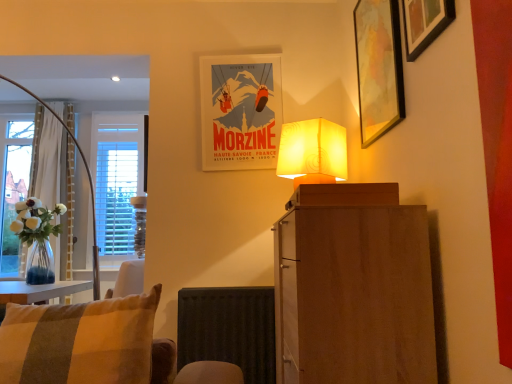
Question: Which direction should I rotate to look at matte paper poster at upper center, the third picture frame viewed from the right?

Choices:
 (A) left
 (B) right

Answer: (A)

Question: Should I look upward or downward to see black matte radiator at lower center?

Choices:
 (A) up
 (B) down

Answer: (B)

Question: Considering the relative sizes of striped fabric cushion at lower left and wooden picture frame at upper right, the second picture frame in the right-to-left sequence, in the image provided, is striped fabric cushion at lower left taller than wooden picture frame at upper right, the second picture frame in the right-to-left sequence,?

Choices:
 (A) yes
 (B) no

Answer: (B)

Question: Is striped fabric cushion at lower left positioned behind wooden picture frame at upper right, which is counted as the second picture frame, starting from the left?

Choices:
 (A) yes
 (B) no

Answer: (B)

Question: Can you confirm if striped fabric cushion at lower left is bigger than wooden picture frame at upper right, the second picture frame in the right-to-left sequence?

Choices:
 (A) no
 (B) yes

Answer: (B)

Question: Does striped fabric cushion at lower left appear on the right side of wooden picture frame at upper right, the second picture frame in the right-to-left sequence?

Choices:
 (A) no
 (B) yes

Answer: (A)

Question: From a real-world perspective, is striped fabric cushion at lower left on top of wooden picture frame at upper right, which is counted as the 2th picture frame, starting from the back?

Choices:
 (A) yes
 (B) no

Answer: (B)

Question: Does striped fabric cushion at lower left have a lesser height compared to wooden picture frame at upper right, which is counted as the 2th picture frame, starting from the back?

Choices:
 (A) no
 (B) yes

Answer: (B)

Question: From a real-world perspective, is black matte radiator at lower center beneath matte paper poster at upper center, which is the first picture frame from back to front?

Choices:
 (A) no
 (B) yes

Answer: (B)

Question: Considering the relative positions of black matte radiator at lower center and matte paper poster at upper center, which is the first picture frame from back to front, in the image provided, is black matte radiator at lower center behind matte paper poster at upper center, which is the first picture frame from back to front,?

Choices:
 (A) no
 (B) yes

Answer: (A)

Question: From the image's perspective, is black matte radiator at lower center over matte paper poster at upper center, the 3th picture frame in the front-to-back sequence?

Choices:
 (A) no
 (B) yes

Answer: (A)

Question: Is black matte radiator at lower center taller than matte paper poster at upper center, the 1th picture frame viewed from the left?

Choices:
 (A) no
 (B) yes

Answer: (A)

Question: Is black matte radiator at lower center smaller than matte paper poster at upper center, the 1th picture frame viewed from the left?

Choices:
 (A) no
 (B) yes

Answer: (A)

Question: Does black matte radiator at lower center have a larger size compared to matte paper poster at upper center, the 1th picture frame viewed from the left?

Choices:
 (A) no
 (B) yes

Answer: (B)

Question: Would you say matte paper poster at upper center, the 3th picture frame in the front-to-back sequence, contains wooden picture frame at upper right, which is counted as the second picture frame, starting from the left?

Choices:
 (A) no
 (B) yes

Answer: (A)